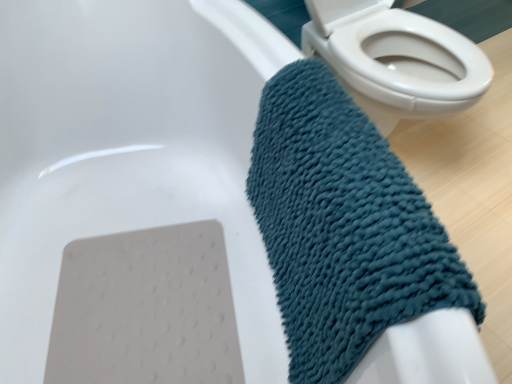
What is the approximate height of teal textured towel at lower right?

teal textured towel at lower right is 40.20 centimeters in height.

Where is `teal textured towel at lower right`? The height and width of the screenshot is (384, 512). teal textured towel at lower right is located at coordinates (343, 227).

This screenshot has width=512, height=384. Describe the element at coordinates (343, 227) in the screenshot. I see `teal textured towel at lower right` at that location.

Locate an element on the screen. teal textured towel at lower right is located at coordinates (343, 227).